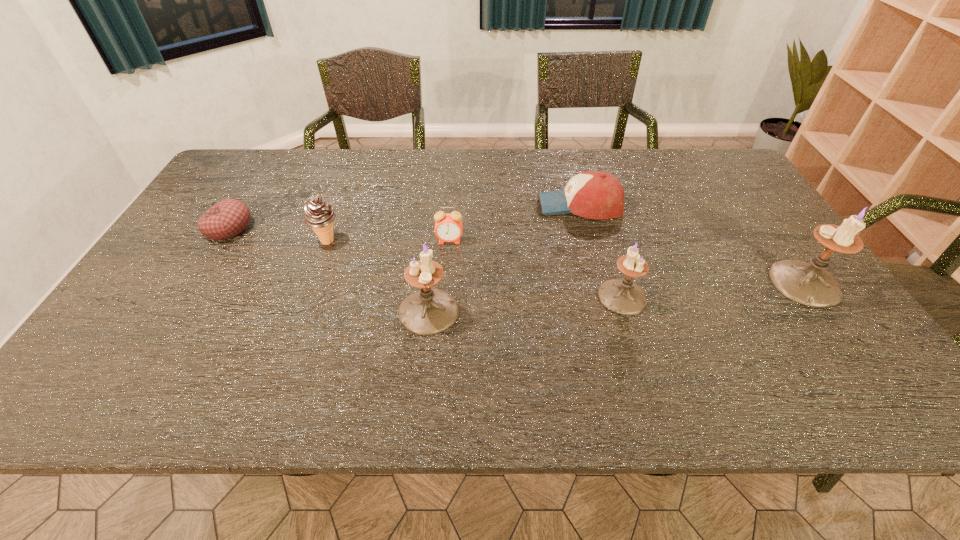
Where is `free spot between the shortest candle holder and the second object from left to right`? free spot between the shortest candle holder and the second object from left to right is located at coordinates (475, 269).

Locate an element on the screen. Image resolution: width=960 pixels, height=540 pixels. vacant region between the rightmost object and the baseball cap is located at coordinates click(x=692, y=244).

This screenshot has width=960, height=540. I want to click on object that can be found as the closest to the baseball cap, so click(x=622, y=296).

Select which object appears as the third closest to the icecream. Please provide its 2D coordinates. Your answer should be formatted as a tuple, i.e. [(x, y)], where the tuple contains the x and y coordinates of a point satisfying the conditions above.

[(448, 227)]

At what (x,y) coordinates should I click in order to perform the action: click on candle holder identified as the closest to the sixth object from right to left. Please return your answer as a coordinate pair (x, y). This screenshot has width=960, height=540. Looking at the image, I should click on (430, 311).

Select which candle holder is the second closest to the second object from left to right. Please provide its 2D coordinates. Your answer should be formatted as a tuple, i.e. [(x, y)], where the tuple contains the x and y coordinates of a point satisfying the conditions above.

[(622, 296)]

Locate an element on the screen. Image resolution: width=960 pixels, height=540 pixels. blank space that satisfies the following two spatial constraints: 1. on the face of the alarm clock; 2. on the left side of the second candle holder from left to right is located at coordinates (445, 296).

Locate an element on the screen. The width and height of the screenshot is (960, 540). vacant area in the image that satisfies the following two spatial constraints: 1. on the face of the rightmost candle holder; 2. on the left side of the alarm clock is located at coordinates (446, 283).

Where is `free space that satisfies the following two spatial constraints: 1. on the face of the shortest candle holder; 2. on the left side of the alarm clock`? free space that satisfies the following two spatial constraints: 1. on the face of the shortest candle holder; 2. on the left side of the alarm clock is located at coordinates (445, 296).

In order to click on vacant space that satisfies the following two spatial constraints: 1. on the front-facing side of the baseball cap; 2. on the face of the alarm clock in this screenshot , I will do `click(589, 241)`.